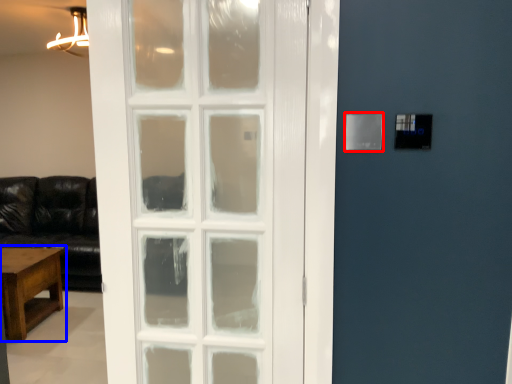
Question: Which object appears closest to the camera in this image, light switch (highlighted by a red box) or table (highlighted by a blue box)?

Choices:
 (A) light switch
 (B) table

Answer: (A)